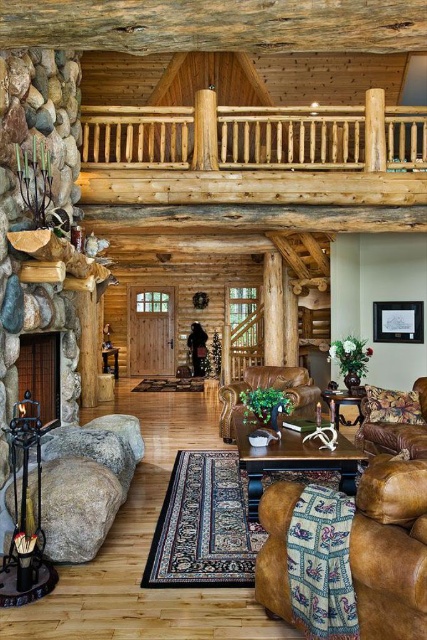
Question: Does wooden coffee table at center appear under brown leather armchair at center?

Choices:
 (A) no
 (B) yes

Answer: (B)

Question: Estimate the real-world distances between objects in this image. Which object is farther from the brown leather armchair at lower right?

Choices:
 (A) wooden coffee table at center
 (B) smooth stone fireplace at left

Answer: (B)

Question: Which of the following is the closest to the observer?

Choices:
 (A) (335, 404)
 (B) (271, 467)
 (C) (248, 380)

Answer: (B)

Question: Observing the image, what is the correct spatial positioning of brown leather armchair at lower right in reference to brown leather armchair at center?

Choices:
 (A) above
 (B) below

Answer: (A)

Question: Does brown leather armchair at lower right have a lesser width compared to brown leather armchair at center?

Choices:
 (A) no
 (B) yes

Answer: (B)

Question: Which of the following is the closest to the observer?

Choices:
 (A) (339, 417)
 (B) (315, 442)
 (C) (379, 440)
 (D) (32, 372)

Answer: (B)